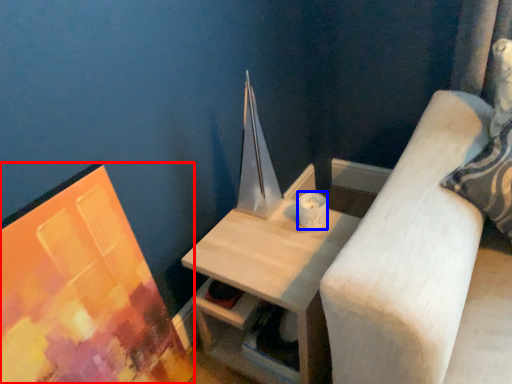
Question: Which of the following is the closest to the observer, picture frame (highlighted by a red box) or candle holder (highlighted by a blue box)?

Choices:
 (A) picture frame
 (B) candle holder

Answer: (A)